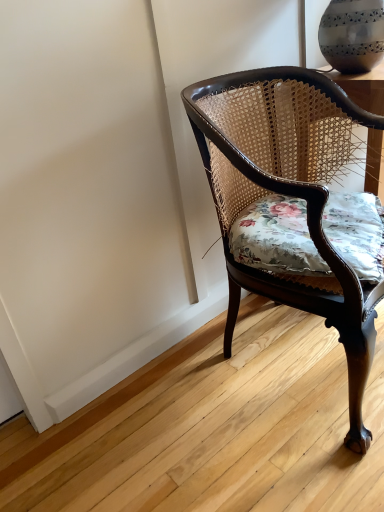
This screenshot has height=512, width=384. I want to click on vacant region below mahogany cane chair at center (from a real-world perspective), so point(291,356).